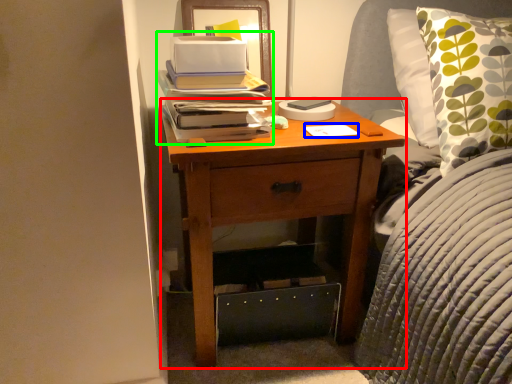
Question: Considering the real-world distances, which object is farthest from nightstand (highlighted by a red box)? notepad (highlighted by a blue box) or book (highlighted by a green box)?

Choices:
 (A) notepad
 (B) book

Answer: (A)